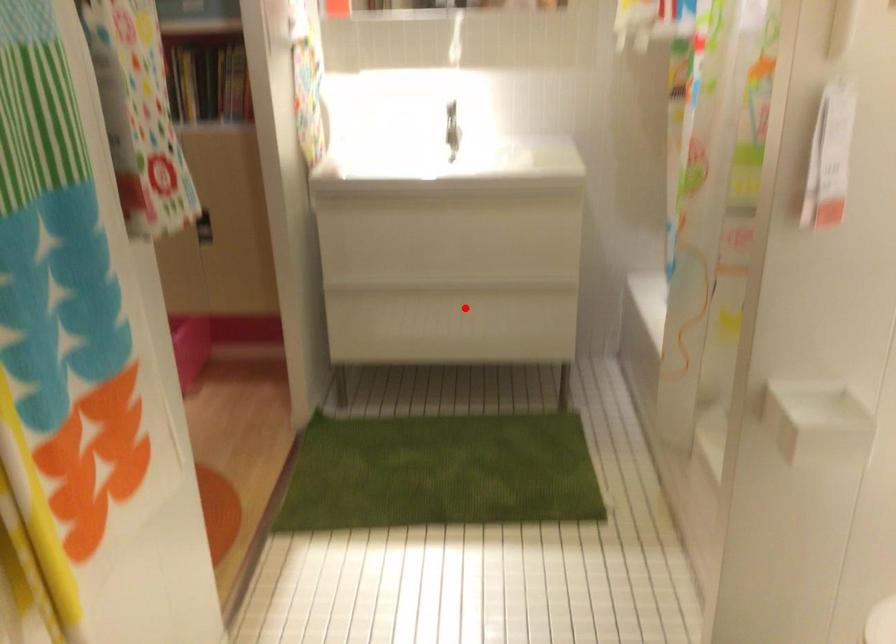
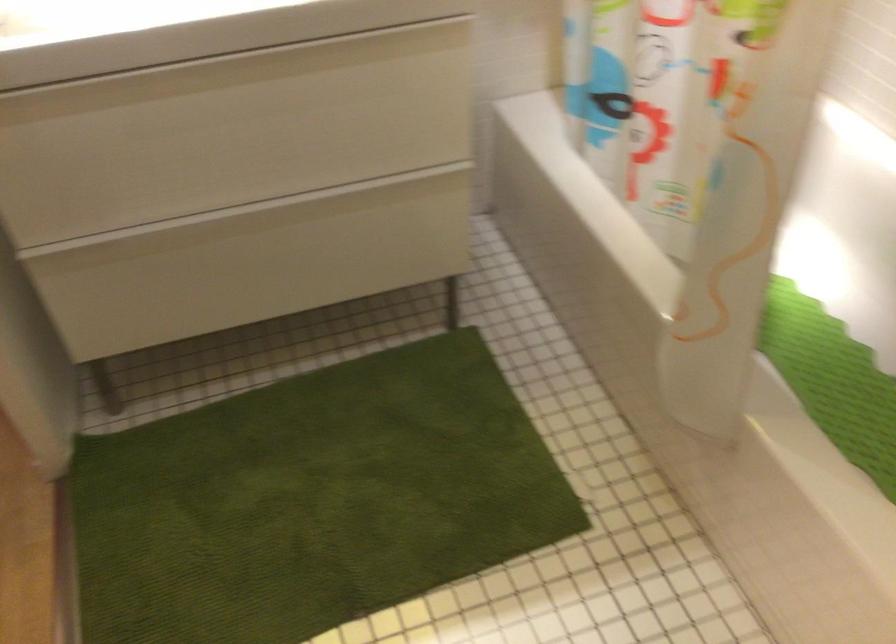
Question: I am providing you with two images of the same scene from different viewpoints. A red point is marked on the first image. Is the red point's position out of view in image 2?

Choices:
 (A) Yes
 (B) No

Answer: (B)